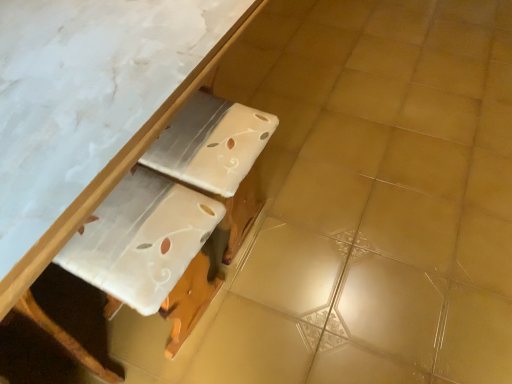
This screenshot has width=512, height=384. I want to click on free space above white glossy cardboard at center (from a real-world perspective), so pos(135,226).